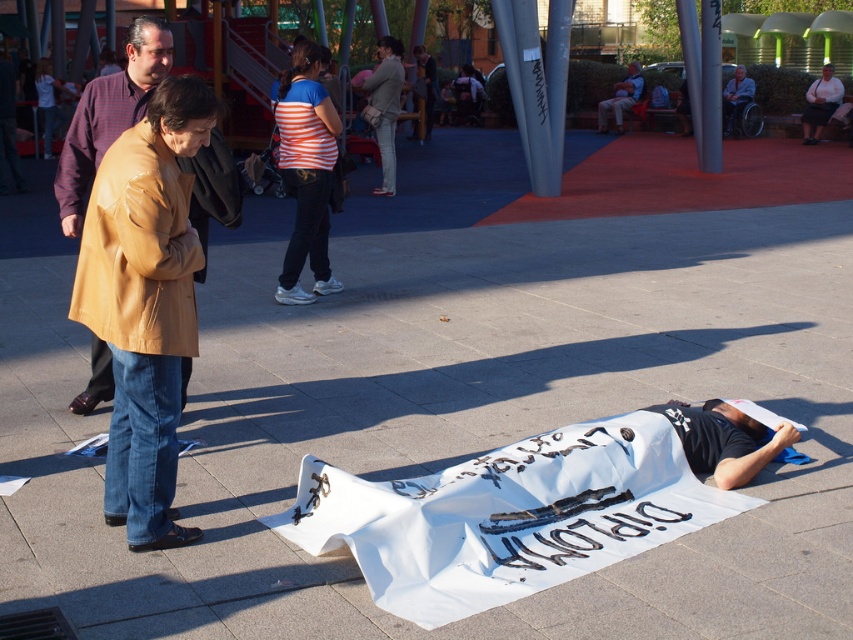
Between striped fabric pants at center and striped fabric shirt at center, which one is positioned higher?

striped fabric shirt at center is above.

Does striped fabric pants at center appear on the right side of striped fabric shirt at center?

No, striped fabric pants at center is not to the right of striped fabric shirt at center.

The width and height of the screenshot is (853, 640). Find the location of `striped fabric pants at center`. striped fabric pants at center is located at coordinates (306, 172).

Between point (297, 186) and point (612, 109), which one is positioned behind?

Positioned behind is point (612, 109).

Can you confirm if striped fabric pants at center is shorter than denim jacket at upper center?

Indeed, striped fabric pants at center has a lesser height compared to denim jacket at upper center.

Which is in front, point (288, 300) or point (614, 102)?

Point (288, 300) is in front.

At what (x,y) coordinates should I click in order to perform the action: click on striped fabric pants at center. Please return your answer as a coordinate pair (x, y). Image resolution: width=853 pixels, height=640 pixels. Looking at the image, I should click on (306, 172).

Can you confirm if denim jacket at upper center is positioned above gray fabric wheelchair at upper right?

Yes.

Can you confirm if denim jacket at upper center is wider than gray fabric wheelchair at upper right?

Correct, the width of denim jacket at upper center exceeds that of gray fabric wheelchair at upper right.

Measure the distance between point (631, 106) and camera.

Point (631, 106) is 25.71 meters away from camera.

Where is `denim jacket at upper center`? denim jacket at upper center is located at coordinates (621, 99).